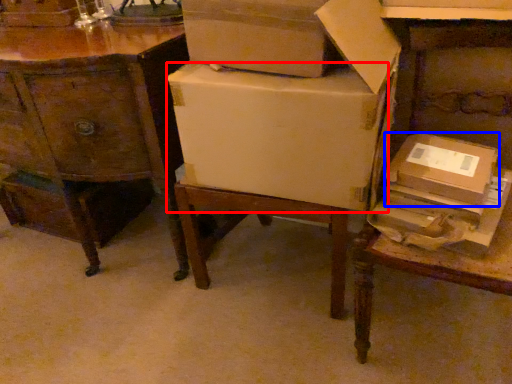
Question: Which object is further to the camera taking this photo, cardboard box (highlighted by a red box) or cardboard box (highlighted by a blue box)?

Choices:
 (A) cardboard box
 (B) cardboard box

Answer: (B)